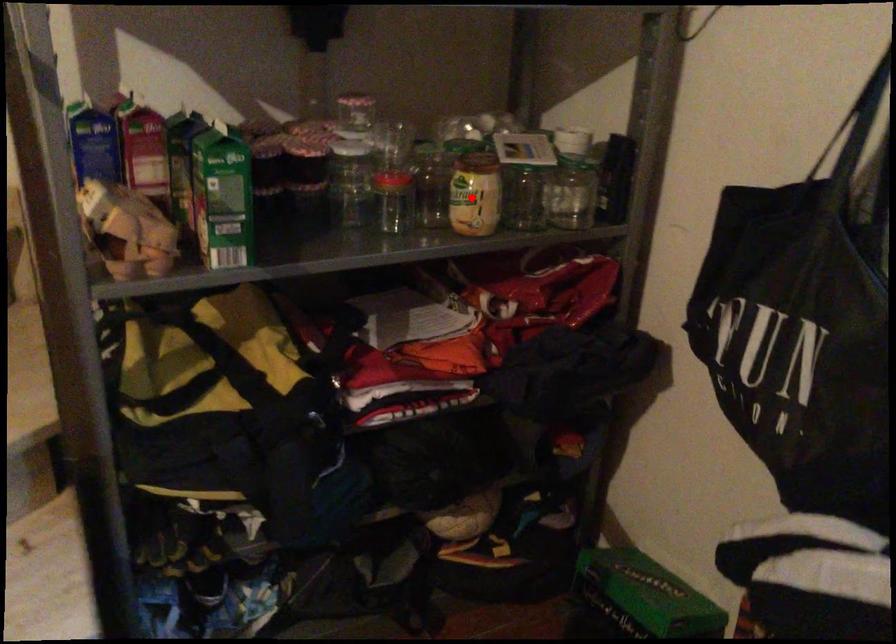
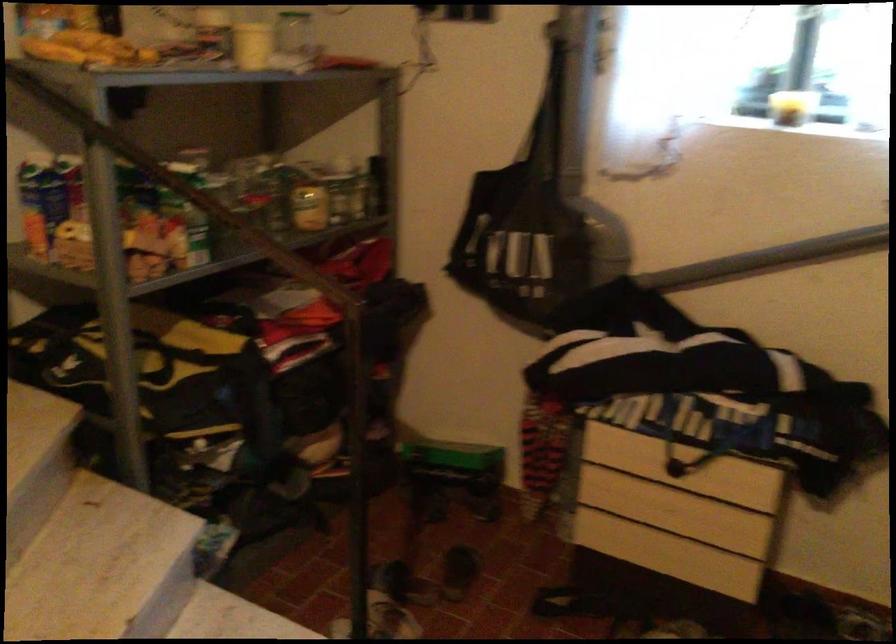
Question: A red point is marked in image1. In image2, is the corresponding 3D point closer to the camera or farther? Reply with the corresponding letter.

Choices:
 (A) The corresponding 3D point is closer.
 (B) The corresponding 3D point is farther.

Answer: (B)